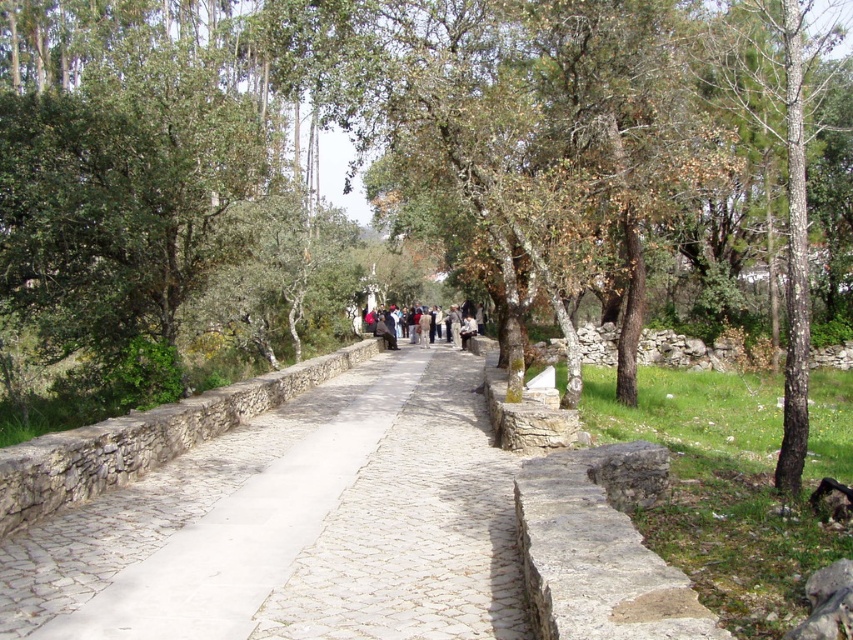
Can you confirm if white stone path at center is smaller than dark gray fabric jacket at center?

Yes.

Who is taller, white stone path at center or dark gray fabric jacket at center?

Standing taller between the two is dark gray fabric jacket at center.

You are a GUI agent. You are given a task and a screenshot of the screen. Output one action in this format:
    pyautogui.click(x=<x>, y=<y>)
    Task: Click on the white stone path at center
    The height and width of the screenshot is (640, 853).
    Given the screenshot: What is the action you would take?
    pyautogui.click(x=296, y=525)